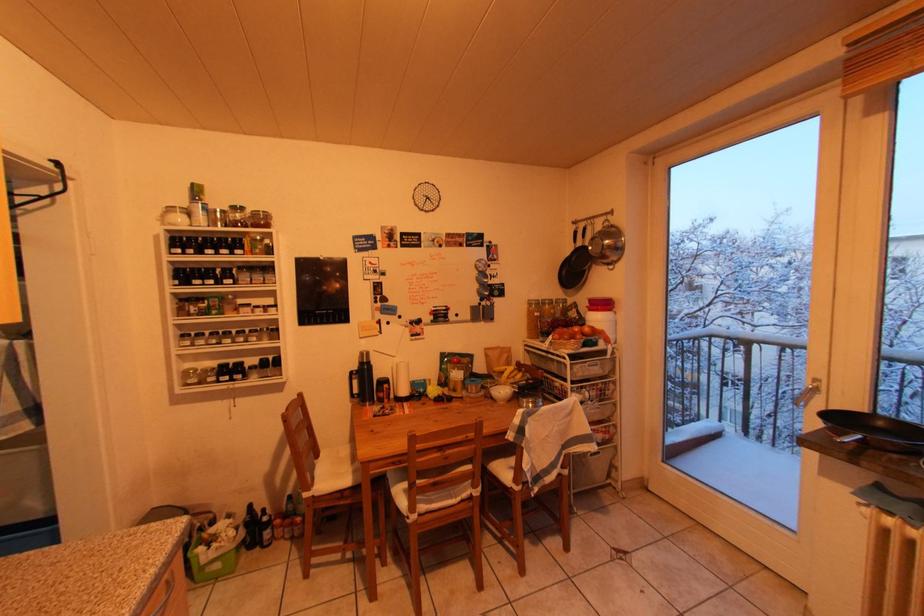
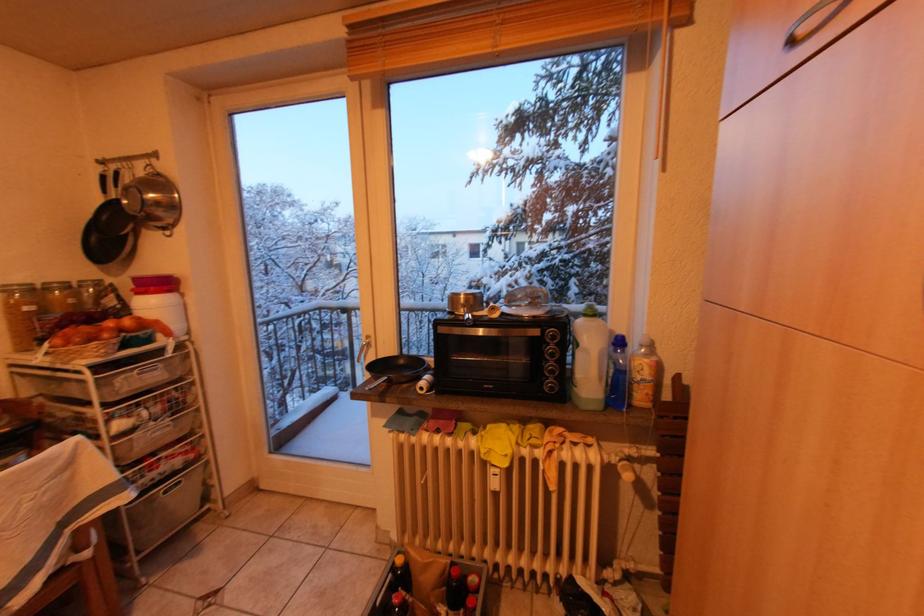
Question: The camera is either moving clockwise (left) or counter-clockwise (right) around the object. The first image is from the beginning of the video and the second image is from the end. Is the camera moving left or right when shooting the video?

Choices:
 (A) Left
 (B) Right

Answer: (A)